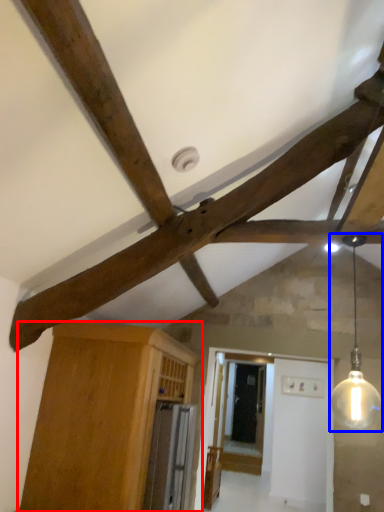
Question: Which object appears farthest to the camera in this image, cabinetry (highlighted by a red box) or light fixture (highlighted by a blue box)?

Choices:
 (A) cabinetry
 (B) light fixture

Answer: (A)